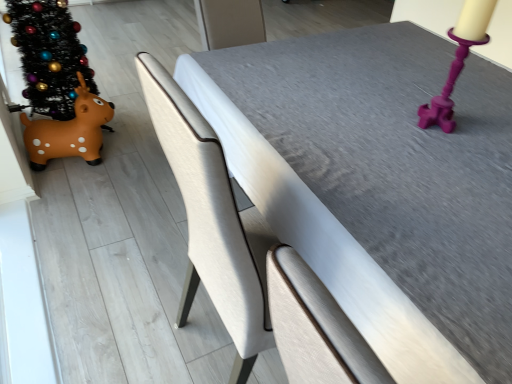
Question: Is black glittery christmas tree at left facing away from brown rubber toy at left?

Choices:
 (A) yes
 (B) no

Answer: (B)

Question: From a real-world perspective, is black glittery christmas tree at left on brown rubber toy at left?

Choices:
 (A) yes
 (B) no

Answer: (A)

Question: Is black glittery christmas tree at left further to the viewer compared to brown rubber toy at left?

Choices:
 (A) yes
 (B) no

Answer: (B)

Question: Is black glittery christmas tree at left aimed at brown rubber toy at left?

Choices:
 (A) no
 (B) yes

Answer: (A)

Question: Is black glittery christmas tree at left in contact with brown rubber toy at left?

Choices:
 (A) no
 (B) yes

Answer: (A)

Question: Which is correct: textured gray table at center is inside brown rubber toy at left, or outside of it?

Choices:
 (A) inside
 (B) outside

Answer: (B)

Question: In the image, is textured gray table at center on the left side or the right side of brown rubber toy at left?

Choices:
 (A) left
 (B) right

Answer: (B)

Question: Is point (423, 137) positioned closer to the camera than point (38, 125)?

Choices:
 (A) closer
 (B) farther

Answer: (A)

Question: From a real-world perspective, is textured gray table at center physically located above or below brown rubber toy at left?

Choices:
 (A) below
 (B) above

Answer: (B)

Question: Is purple plastic candle holder at upper right spatially inside black glittery christmas tree at left, or outside of it?

Choices:
 (A) outside
 (B) inside

Answer: (A)

Question: Is purple plastic candle holder at upper right taller or shorter than black glittery christmas tree at left?

Choices:
 (A) tall
 (B) short

Answer: (B)

Question: Considering the positions of point (484, 39) and point (30, 54), is point (484, 39) closer or farther from the camera than point (30, 54)?

Choices:
 (A) farther
 (B) closer

Answer: (B)

Question: In terms of width, does purple plastic candle holder at upper right look wider or thinner when compared to black glittery christmas tree at left?

Choices:
 (A) wide
 (B) thin

Answer: (B)

Question: In the image, is brown rubber toy at left on the left side or the right side of black glittery christmas tree at left?

Choices:
 (A) right
 (B) left

Answer: (A)

Question: Considering their positions, is brown rubber toy at left located in front of or behind black glittery christmas tree at left?

Choices:
 (A) front
 (B) behind

Answer: (B)